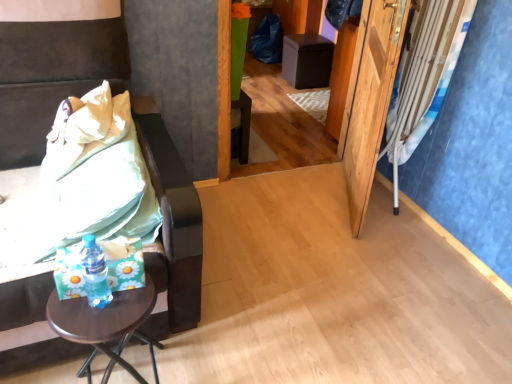
Identify the location of free space to the back side of brown wooden table at lower left. (165, 344).